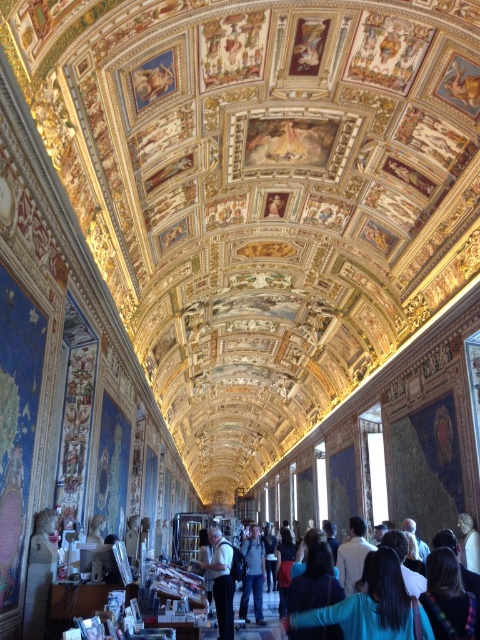
You are a tour guide standing at the entrance of the Vatican Museums. You notice a visitor with dark brown hair at lower right who is 29.21 meters away. Can you approach them directly without any obstacles?

The dark brown hair at lower right is 29.21 meters away from the camera, so you can approach them directly as there are no mentioned obstacles in the scene description.

You are an art historian examining the Gallery of Maps in the Vatican Museums. You notice a small detail at point (448, 598). What object is located at this coordinate?

The point (448, 598) indicates dark brown hair at lower right.

You are an art student visiting the Vatican Museums and notice two details in the Gallery of Maps. You see a dark brown hair at lower right and a dark blue shirt at center. Which of these two details is narrower in width?

The dark brown hair at lower right is thinner than the dark blue shirt at center, so the dark brown hair at lower right is narrower in width.